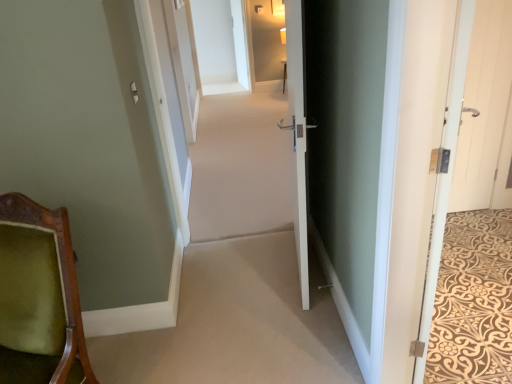
Question: Is white glossy door at center, which ranks as the 4th door in right-to-left order, inside the boundaries of green velvet chair at lower left, or outside?

Choices:
 (A) inside
 (B) outside

Answer: (B)

Question: From the image's perspective, relative to green velvet chair at lower left, is white glossy door at center, which ranks as the 4th door in right-to-left order, above or below?

Choices:
 (A) above
 (B) below

Answer: (A)

Question: Estimate the real-world distances between objects in this image. Which object is farther from the white glossy door at center, which appears as the 1th door when viewed from the left?

Choices:
 (A) white wood door at right, the 4th door from the left
 (B) white wooden door at right, the second door from the right
 (C) white wood door at right, the third door positioned from the right
 (D) green velvet chair at lower left
 (E) beige carpet at center

Answer: (E)

Question: Estimate the real-world distances between objects in this image. Which object is closer to the beige carpet at center?

Choices:
 (A) green velvet chair at lower left
 (B) white glossy door at center, which appears as the 1th door when viewed from the left
 (C) white wooden door at right, the 3th door positioned from the left
 (D) white wood door at right, the 4th door from the left
 (E) white wood door at right, the third door positioned from the right

Answer: (B)